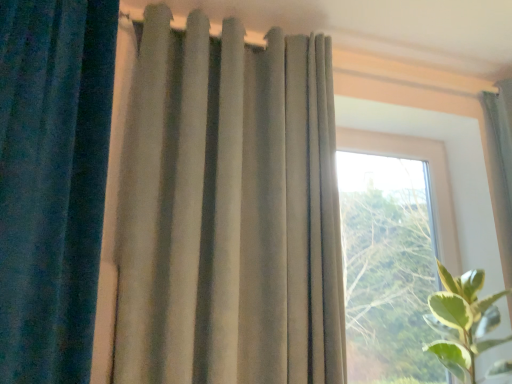
Question: Which is correct: satin beige curtain at upper right, placed as the first curtain when sorted from right to left, is inside green leafy plant at right, or outside of it?

Choices:
 (A) outside
 (B) inside

Answer: (A)

Question: Looking at their shapes, would you say satin beige curtain at upper right, placed as the first curtain when sorted from right to left, is wider or thinner than green leafy plant at right?

Choices:
 (A) wide
 (B) thin

Answer: (B)

Question: Which of these objects is positioned closest to the suede-like beige curtain at center, acting as the second curtain starting from the left?

Choices:
 (A) green leafy plant at right
 (B) satin beige curtain at upper right, placed as the first curtain when sorted from right to left
 (C) transparent glass window at center
 (D) velvet blue curtain at left, which appears as the third curtain when viewed from the right

Answer: (D)

Question: Based on their relative distances, which object is farther from the green leafy plant at right?

Choices:
 (A) velvet blue curtain at left, which appears as the third curtain when viewed from the right
 (B) transparent glass window at center
 (C) satin beige curtain at upper right, the 3th curtain in the left-to-right sequence
 (D) suede-like beige curtain at center, marked as the second curtain in a right-to-left arrangement

Answer: (A)